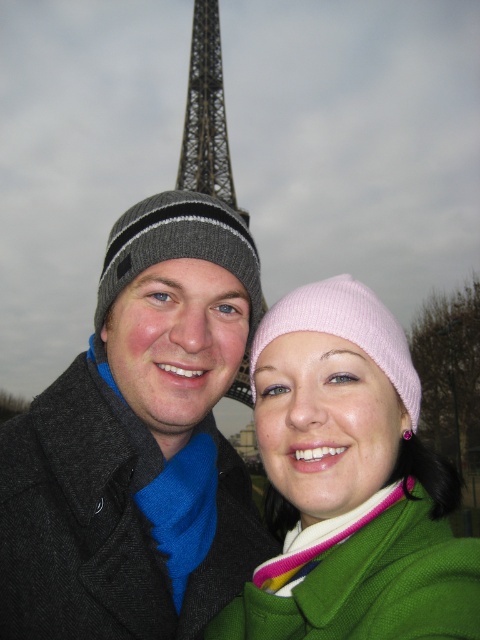
Question: Which object is the farthest from the gray knit beanie at left?

Choices:
 (A) metallic lattice structure at center
 (B) pink knit beanie at center
 (C) dark gray knit hat at left
 (D) metallic lattice structure at upper center

Answer: (B)

Question: Which of these objects is positioned closest to the metallic lattice structure at upper center?

Choices:
 (A) metallic lattice structure at center
 (B) pink knit beanie at center

Answer: (A)

Question: Is metallic lattice structure at center in front of metallic lattice structure at upper center?

Choices:
 (A) yes
 (B) no

Answer: (A)

Question: Observing the image, what is the correct spatial positioning of gray knit beanie at left in reference to metallic lattice structure at upper center?

Choices:
 (A) right
 (B) left

Answer: (B)

Question: Does pink knit beanie at center appear under gray knit beanie at left?

Choices:
 (A) no
 (B) yes

Answer: (B)

Question: Which is nearer to the pink knit beanie at center?

Choices:
 (A) gray knit beanie at left
 (B) metallic lattice structure at center
 (C) dark gray knit hat at left

Answer: (C)